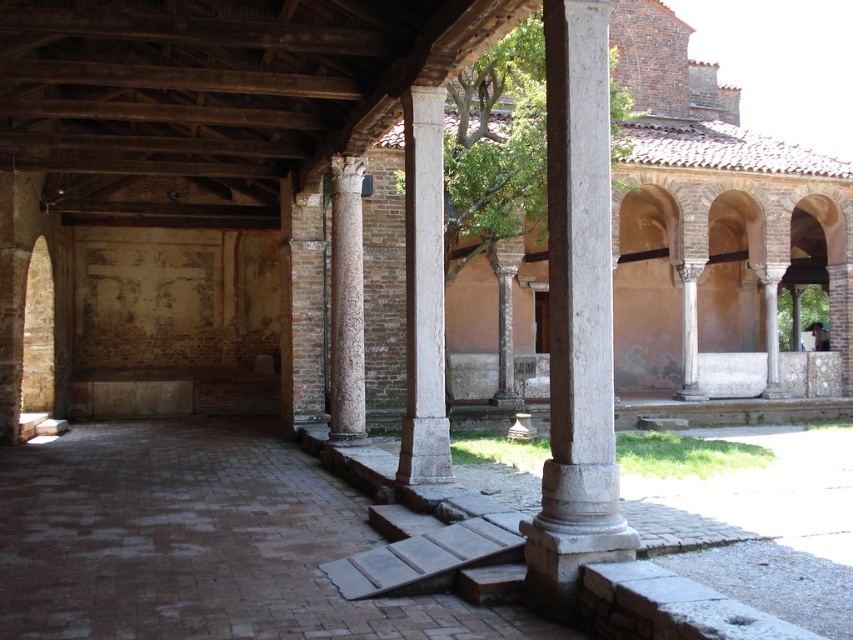
Which is in front, point (408, 353) or point (337, 403)?

Point (408, 353) is in front.

Can you confirm if white stone column at center is taller than brown textured column at center?

Incorrect, white stone column at center's height is not larger of brown textured column at center's.

Who is more forward, (x=402, y=480) or (x=341, y=248)?

Point (x=402, y=480) is more forward.

Where is `white stone column at center`? The width and height of the screenshot is (853, 640). white stone column at center is located at coordinates (424, 292).

Does smooth stone column at center appear on the left side of brown textured column at center?

Incorrect, smooth stone column at center is not on the left side of brown textured column at center.

Image resolution: width=853 pixels, height=640 pixels. What do you see at coordinates (577, 314) in the screenshot? I see `smooth stone column at center` at bounding box center [577, 314].

The height and width of the screenshot is (640, 853). Identify the location of smooth stone column at center. (577, 314).

The width and height of the screenshot is (853, 640). Describe the element at coordinates (577, 314) in the screenshot. I see `smooth stone column at center` at that location.

Can you confirm if smooth stone column at center is positioned below white stone column at center?

Yes, smooth stone column at center is below white stone column at center.

In order to click on smooth stone column at center in this screenshot , I will do `click(577, 314)`.